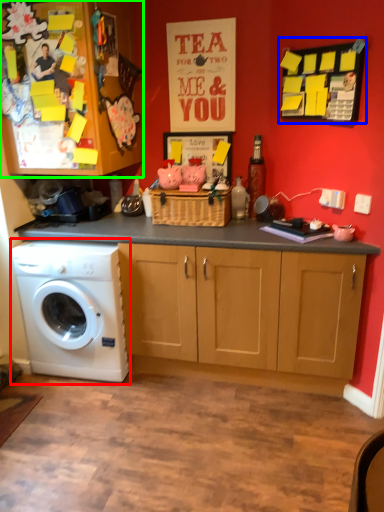
Question: Estimate the real-world distances between objects in this image. Which object is closer to washing machine (highlighted by a red box), bulletin board (highlighted by a blue box) or cabinetry (highlighted by a green box)?

Choices:
 (A) bulletin board
 (B) cabinetry

Answer: (B)